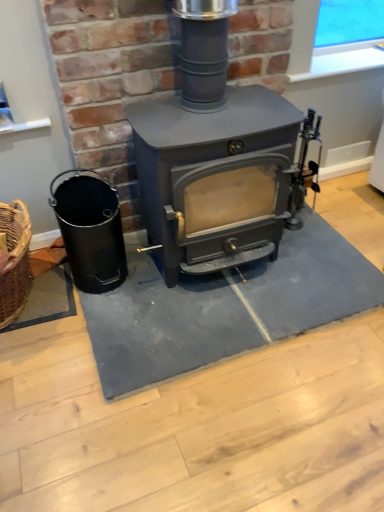
Image resolution: width=384 pixels, height=512 pixels. I want to click on vacant area that is in front of gray rubber doormat at center, so click(231, 420).